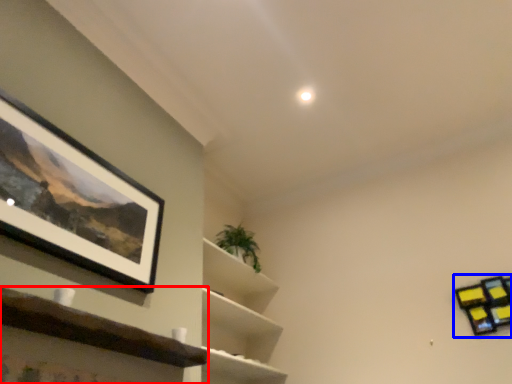
Question: Which point is further to the camera, shelf (highlighted by a red box) or shelf (highlighted by a blue box)?

Choices:
 (A) shelf
 (B) shelf

Answer: (B)